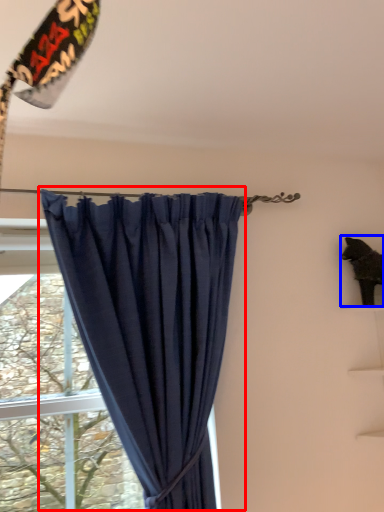
Question: Which of the following is the farthest to the observer, curtain (highlighted by a red box) or animal (highlighted by a blue box)?

Choices:
 (A) curtain
 (B) animal

Answer: (B)